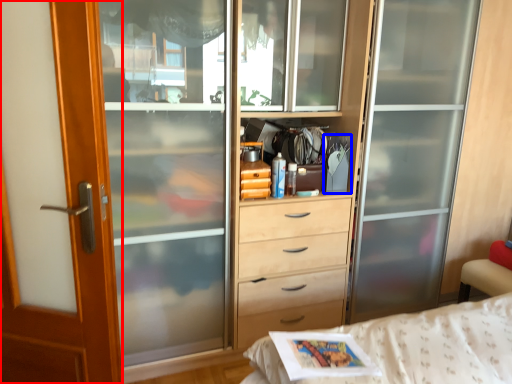
Question: Which object appears farthest to the camera in this image, screen door (highlighted by a red box) or magazine (highlighted by a blue box)?

Choices:
 (A) screen door
 (B) magazine

Answer: (B)